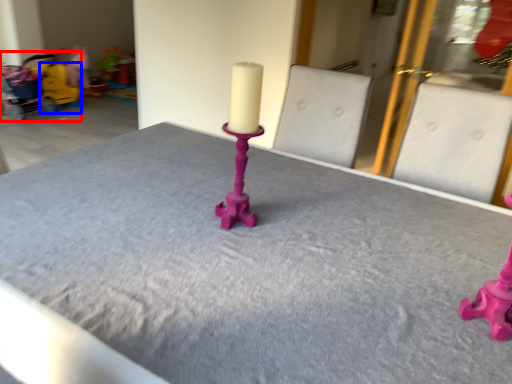
Question: Which object appears closest to the camera in this image, baby carriage (highlighted by a red box) or toy (highlighted by a blue box)?

Choices:
 (A) baby carriage
 (B) toy

Answer: (A)